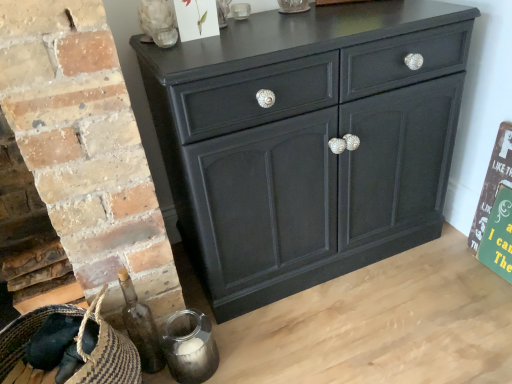
Question: In the image, is matte black cabinet at center on the left side or the right side of braided straw basket at lower left?

Choices:
 (A) left
 (B) right

Answer: (B)

Question: From a real-world perspective, is matte black cabinet at center physically located above or below braided straw basket at lower left?

Choices:
 (A) above
 (B) below

Answer: (A)

Question: Which is farther from the matte black cabinet at center?

Choices:
 (A) rustic wood sign at right
 (B) braided straw basket at lower left
 (C) transparent glass skull at upper left

Answer: (B)

Question: Considering the real-world distances, which object is farthest from the transparent glass skull at upper left?

Choices:
 (A) rustic wood sign at right
 (B) braided straw basket at lower left
 (C) matte black cabinet at center

Answer: (A)